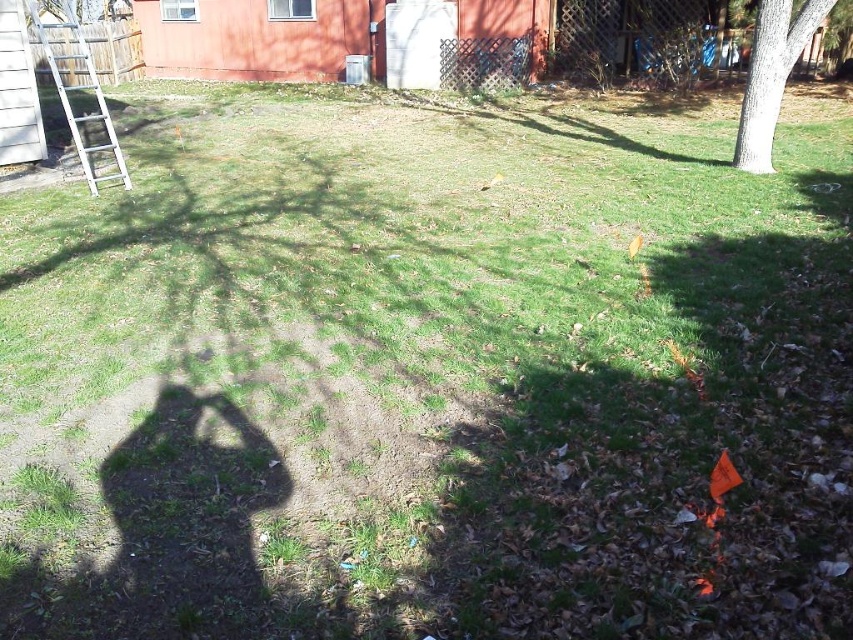
You are planning to place a new bench in the backyard. The bench requires a space as large as the white metallic ladder at left. Can the white smooth tree at upper right fit in that space?

The white smooth tree at upper right occupies less space than the white metallic ladder at left, so it can fit in the space required for the bench.